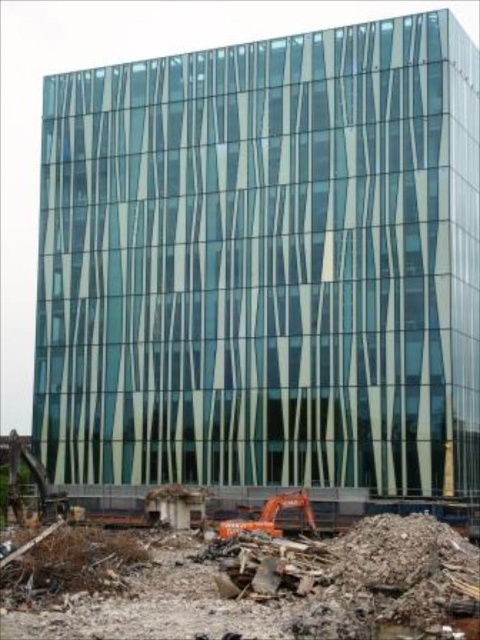
You are a construction worker needing to move a heavy equipment from the orange metallic excavator at lower center to the edge of the construction site. Considering the space available between the rubble concrete at lower center and the building, can you safely maneuver the equipment without hitting the building?

The rubble concrete at lower center has a larger width than the orange metallic excavator at lower center. This means there is sufficient space between the rubble and the building to safely maneuver the equipment without hitting the building.

You are standing at the point marked as point [253,586] in the image. What is the surface you are currently standing on?

The point [253,586] is on rubble concrete at lower center, so you are standing on rubble concrete.